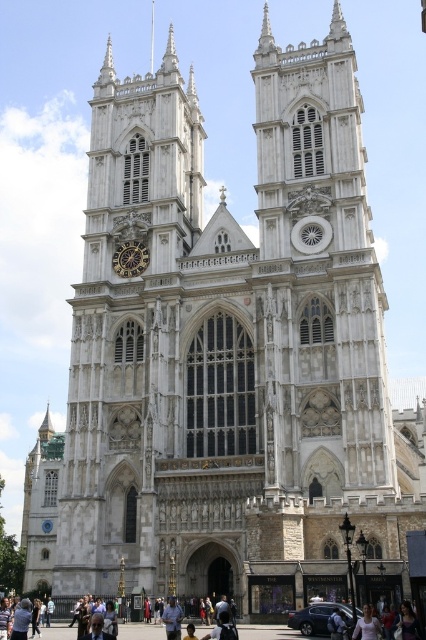
Is white matte shirt at lower center bigger than light blue jeans at center?

No.

Who is higher up, white matte shirt at lower center or light blue jeans at center?

white matte shirt at lower center is above.

Is point (357, 627) farther from viewer compared to point (169, 611)?

That is False.

What are the coordinates of `white matte shirt at lower center` in the screenshot? It's located at (367, 625).

From the picture: Does goldmetallicclock at left have a lesser width compared to white matte shirt at lower center?

Incorrect, goldmetallicclock at left's width is not less than white matte shirt at lower center's.

Who is shorter, goldmetallicclock at left or white matte shirt at lower center?

Standing shorter between the two is goldmetallicclock at left.

Does point (117, 257) lie behind point (367, 611)?

Yes.

I want to click on goldmetallicclock at left, so click(131, 259).

Which is behind, point (135, 264) or point (175, 632)?

Positioned behind is point (135, 264).

Between goldmetallicclock at left and light blue jeans at center, which one is positioned lower?

light blue jeans at center is below.

Describe the element at coordinates (131, 259) in the screenshot. I see `goldmetallicclock at left` at that location.

Identify the location of goldmetallicclock at left. The height and width of the screenshot is (640, 426). (131, 259).